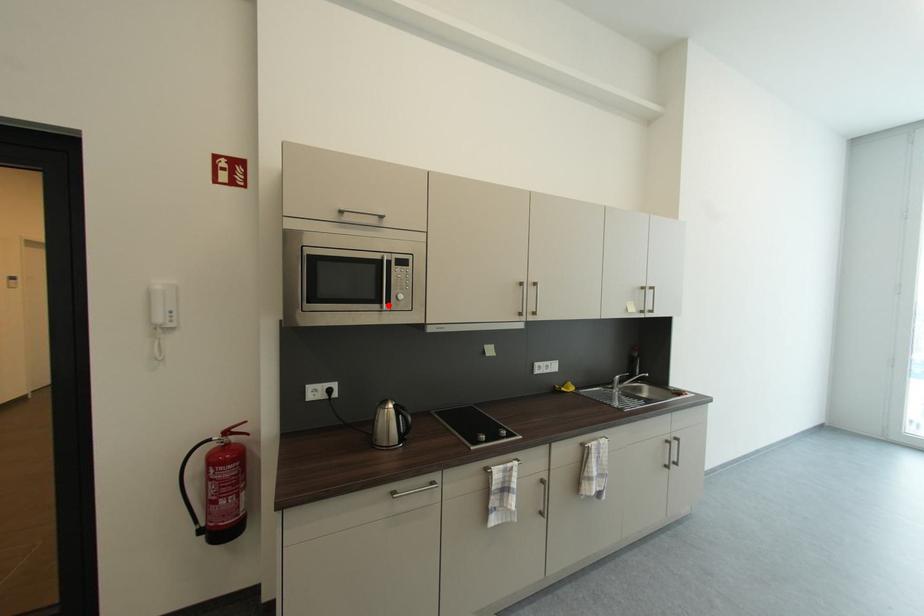
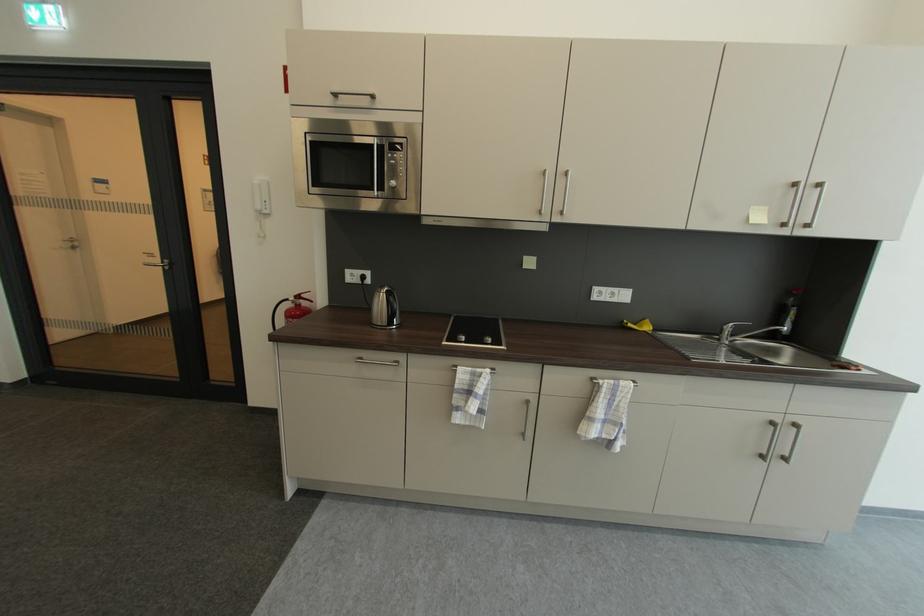
Find the pixel in the second image that matches the highlighted location in the first image.

(380, 191)